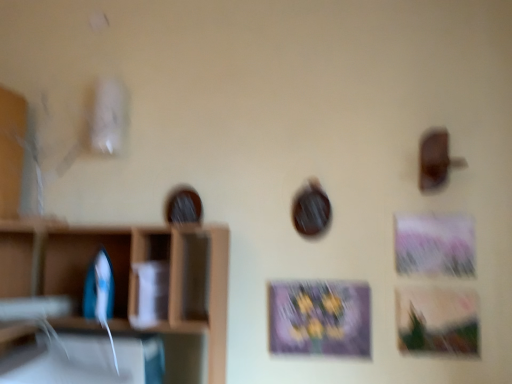
Question: In terms of height, does matte purple picture frame at center look taller or shorter compared to blue plastic iron at left?

Choices:
 (A) tall
 (B) short

Answer: (A)

Question: In the image, is matte purple picture frame at center positioned in front of or behind blue plastic iron at left?

Choices:
 (A) behind
 (B) front

Answer: (A)

Question: Which is farther from the wooden shelf at left?

Choices:
 (A) blue plastic iron at left
 (B) matte purple picture frame at center

Answer: (B)

Question: Estimate the real-world distances between objects in this image. Which object is farther from the matte purple picture frame at center?

Choices:
 (A) blue plastic iron at left
 (B) wooden shelf at left

Answer: (A)